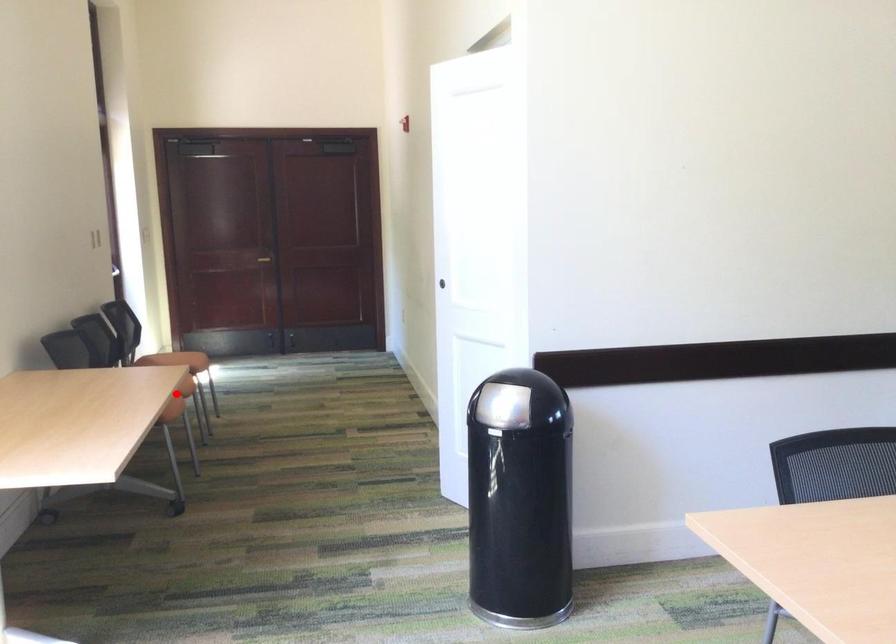
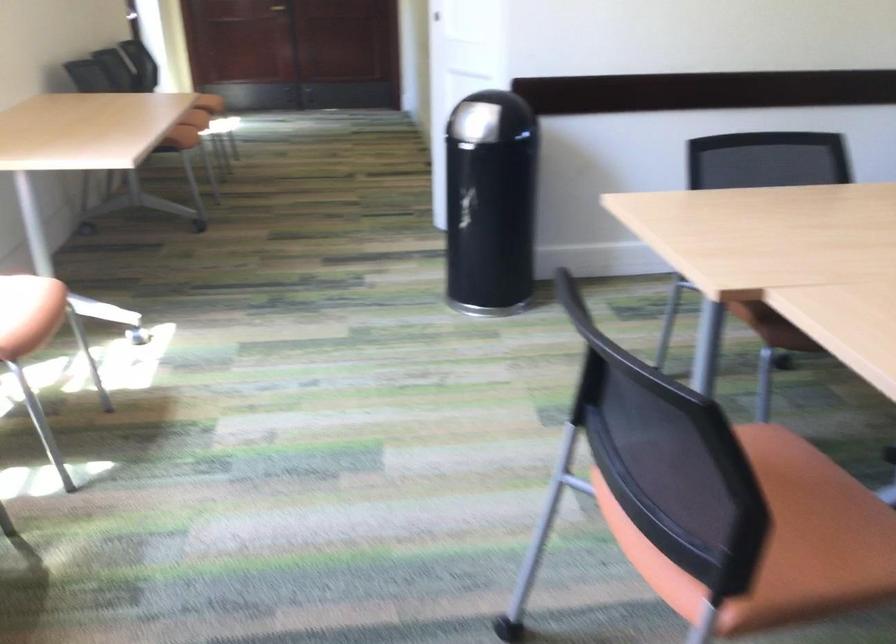
Find the pixel in the second image that matches the highlighted location in the first image.

(192, 124)